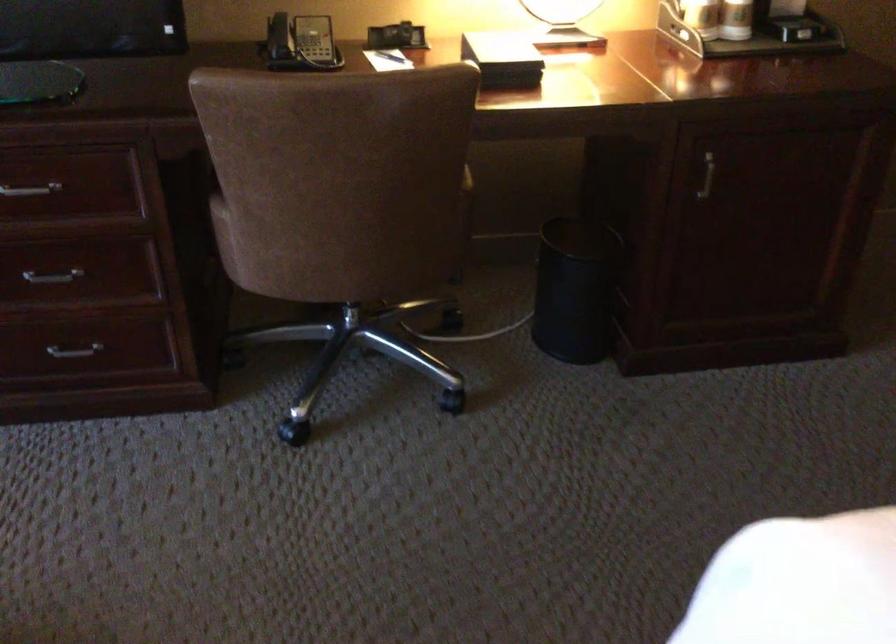
Find where to grasp the white pen. Please return your answer as a coordinate pair (x, y).

(391, 55)